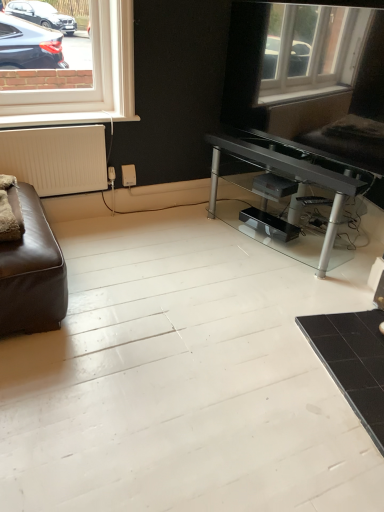
Question: Is white matte radiator at left facing towards black matte table at lower right?

Choices:
 (A) yes
 (B) no

Answer: (A)

Question: Considering the relative sizes of white matte radiator at left and black matte table at lower right in the image provided, is white matte radiator at left smaller than black matte table at lower right?

Choices:
 (A) no
 (B) yes

Answer: (A)

Question: Can you confirm if white matte radiator at left is positioned to the right of black matte table at lower right?

Choices:
 (A) yes
 (B) no

Answer: (B)

Question: Is white matte radiator at left completely or partially outside of black matte table at lower right?

Choices:
 (A) yes
 (B) no

Answer: (A)

Question: Is black matte table at lower right surrounded by white matte radiator at left?

Choices:
 (A) yes
 (B) no

Answer: (B)

Question: Does white matte radiator at left have a lesser height compared to black matte table at lower right?

Choices:
 (A) yes
 (B) no

Answer: (B)

Question: Would you say black matte table at lower right is outside white matte radiator at left?

Choices:
 (A) yes
 (B) no

Answer: (A)

Question: From a real-world perspective, does black matte table at lower right stand above white matte radiator at left?

Choices:
 (A) yes
 (B) no

Answer: (B)

Question: From the image's perspective, is black matte table at lower right on white matte radiator at left?

Choices:
 (A) no
 (B) yes

Answer: (A)

Question: Considering the relative positions of black matte table at lower right and white matte radiator at left in the image provided, is black matte table at lower right to the right of white matte radiator at left from the viewer's perspective?

Choices:
 (A) no
 (B) yes

Answer: (B)

Question: Does black matte table at lower right have a smaller size compared to white matte radiator at left?

Choices:
 (A) no
 (B) yes

Answer: (B)

Question: Does black matte table at lower right have a lesser width compared to white matte radiator at left?

Choices:
 (A) yes
 (B) no

Answer: (B)

Question: Is black matte table at lower right to the left or to the right of white matte radiator at left in the image?

Choices:
 (A) left
 (B) right

Answer: (B)